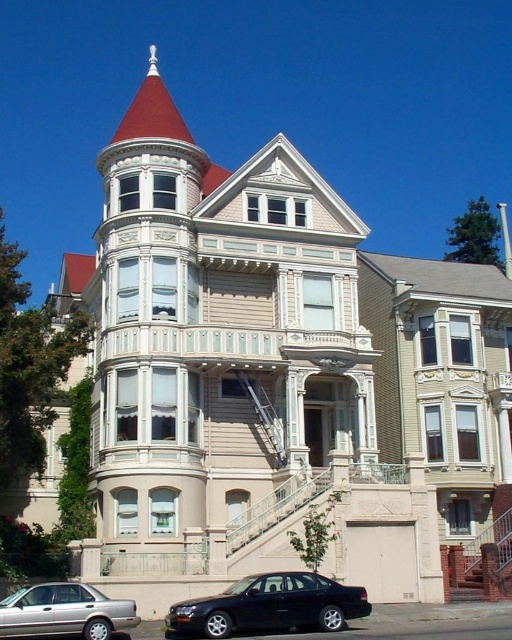
You are standing in front of the Victorian house and notice two points marked on the facade. The first point is at coordinate point (261, 605) and the second is at point (2, 634). Which point is closer to you?

Point (261, 605) is closer to you because it is further to the viewer than point (2, 634).

You are a delivery person trying to park a tall delivery van that is 2 meters in height. You see the black matte sedan at lower center and the silver metallic sedan at lower left in the driveway. Can you safely park your van between them without hitting the overhead garage door which is 2.2 meters high?

The black matte sedan at lower center is taller than the silver metallic sedan at lower left. Since the overhead garage door is 2.2 meters high and your van is 2 meters tall, there should be enough clearance. However, you should ensure that the tallest vehicle, the black matte sedan at lower center, does not exceed the garage door height. If the black sedan is under 2.2 meters, then it should be safe.

You are standing in front of the Victorian house and see the black matte sedan at lower center. If you want to walk to the sedan, how many steps would you estimate taking, assuming each step is about 2.5 feet?

The black matte sedan at lower center is 117.79 feet away. Dividing the distance by the step length of 2.5 feet gives approximately 47 steps. Therefore, you would need to take around 47 steps to reach the sedan.